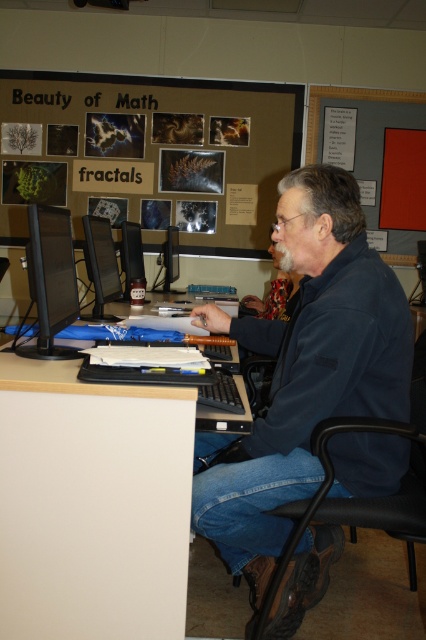
Question: Which object is positioned farthest from the matte black monitor at center?

Choices:
 (A) black glossy monitor at left
 (B) black plastic swivel chair at lower right

Answer: (B)

Question: Which is farther from the smooth gray poster at upper right?

Choices:
 (A) black plastic swivel chair at lower right
 (B) matte black monitor at center
 (C) black glossy monitor at left

Answer: (C)

Question: Does dark blue fleece at center have a larger size compared to black plastic swivel chair at lower right?

Choices:
 (A) yes
 (B) no

Answer: (A)

Question: In this image, where is dark blue fleece at center located relative to black plastic swivel chair at lower right?

Choices:
 (A) left
 (B) right

Answer: (A)

Question: Is black plastic swivel chair at lower right smaller than black glossy monitor at left?

Choices:
 (A) yes
 (B) no

Answer: (B)

Question: Which is farther from the dark blue fleece at center?

Choices:
 (A) smooth gray poster at upper right
 (B) black plastic swivel chair at lower right

Answer: (A)